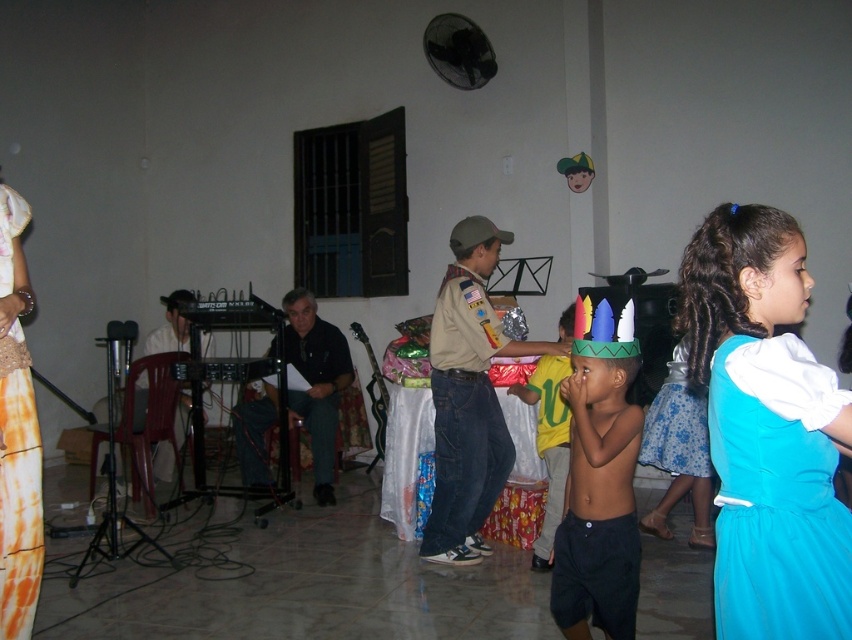
What do you see at coordinates (776, 493) in the screenshot? The image size is (852, 640). I see `turquoise satin dress at right` at bounding box center [776, 493].

Is turquoise satin dress at right positioned behind yellow fabric shirt at center?

That is False.

The image size is (852, 640). Find the location of `turquoise satin dress at right`. turquoise satin dress at right is located at coordinates (776, 493).

Can you confirm if multicolored paper crown at center is taller than turquoise satin dress at right?

No, multicolored paper crown at center is not taller than turquoise satin dress at right.

Is multicolored paper crown at center smaller than turquoise satin dress at right?

No, multicolored paper crown at center is not smaller than turquoise satin dress at right.

This screenshot has height=640, width=852. I want to click on multicolored paper crown at center, so click(x=315, y=589).

Is turquoise satin dress at right bigger than blue satin dress at lower right?

No, turquoise satin dress at right is not bigger than blue satin dress at lower right.

Is turquoise satin dress at right to the right of blue satin dress at lower right from the viewer's perspective?

In fact, turquoise satin dress at right is to the left of blue satin dress at lower right.

Locate an element on the screen. turquoise satin dress at right is located at coordinates tap(776, 493).